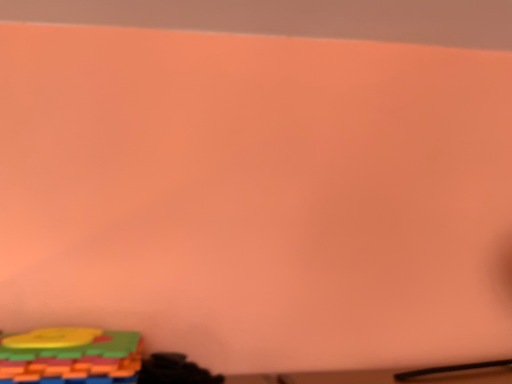
Question: Is the depth of multicolored plastic blocks at lower left, which is counted as the second toy, starting from the right, less than that of black matte toy at lower left, the first toy when ordered from right to left?

Choices:
 (A) no
 (B) yes

Answer: (B)

Question: From the image's perspective, is multicolored plastic blocks at lower left, which is counted as the second toy, starting from the right, under black matte toy at lower left, the second toy positioned from the left?

Choices:
 (A) yes
 (B) no

Answer: (B)

Question: Is multicolored plastic blocks at lower left, which is counted as the second toy, starting from the right, further to the viewer compared to black matte toy at lower left, the first toy when ordered from right to left?

Choices:
 (A) yes
 (B) no

Answer: (B)

Question: Is multicolored plastic blocks at lower left, which is counted as the second toy, starting from the right, far away from black matte toy at lower left, the first toy when ordered from right to left?

Choices:
 (A) yes
 (B) no

Answer: (B)

Question: Could black matte toy at lower left, the second toy positioned from the left, be considered to be inside multicolored plastic blocks at lower left, positioned as the first toy in left-to-right order?

Choices:
 (A) no
 (B) yes

Answer: (A)

Question: Is multicolored plastic blocks at lower left, positioned as the first toy in left-to-right order, to the left of black matte toy at lower left, the first toy when ordered from right to left, from the viewer's perspective?

Choices:
 (A) yes
 (B) no

Answer: (A)

Question: Does black matte toy at lower left, the first toy when ordered from right to left, lie in front of multicolored plastic blocks at lower left, which is counted as the second toy, starting from the right?

Choices:
 (A) yes
 (B) no

Answer: (B)

Question: From a real-world perspective, is black matte toy at lower left, the second toy positioned from the left, physically below multicolored plastic blocks at lower left, which is counted as the second toy, starting from the right?

Choices:
 (A) yes
 (B) no

Answer: (A)

Question: Can we say black matte toy at lower left, the second toy positioned from the left, lies outside multicolored plastic blocks at lower left, which is counted as the second toy, starting from the right?

Choices:
 (A) yes
 (B) no

Answer: (A)

Question: Would you consider black matte toy at lower left, the second toy positioned from the left, to be distant from multicolored plastic blocks at lower left, which is counted as the second toy, starting from the right?

Choices:
 (A) no
 (B) yes

Answer: (A)

Question: From the image's perspective, does black matte toy at lower left, the first toy when ordered from right to left, appear lower than multicolored plastic blocks at lower left, which is counted as the second toy, starting from the right?

Choices:
 (A) yes
 (B) no

Answer: (A)

Question: Does black matte toy at lower left, the first toy when ordered from right to left, appear on the left side of multicolored plastic blocks at lower left, which is counted as the second toy, starting from the right?

Choices:
 (A) no
 (B) yes

Answer: (A)

Question: Would you say multicolored plastic blocks at lower left, which is counted as the second toy, starting from the right, is to the left or to the right of black matte toy at lower left, the first toy when ordered from right to left, in the picture?

Choices:
 (A) right
 (B) left

Answer: (B)